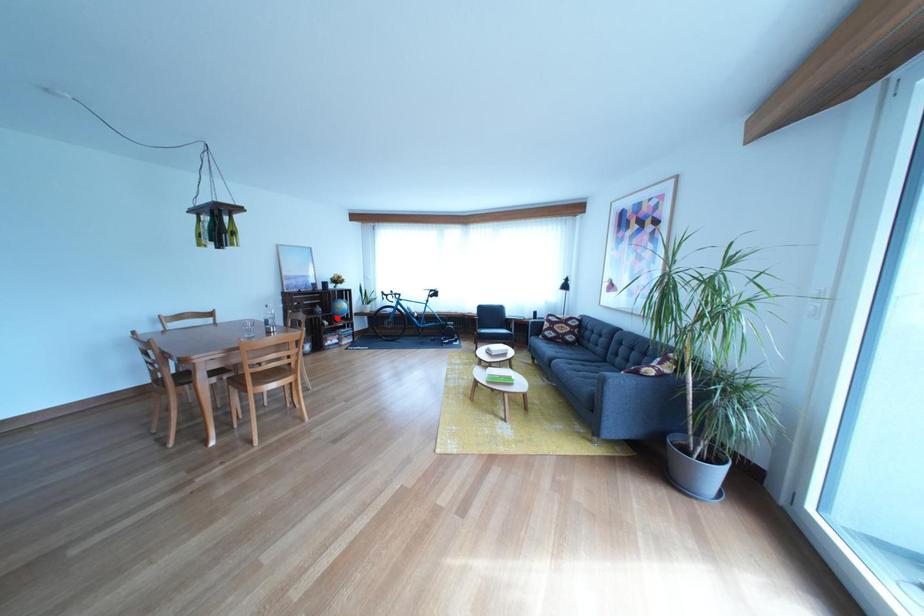
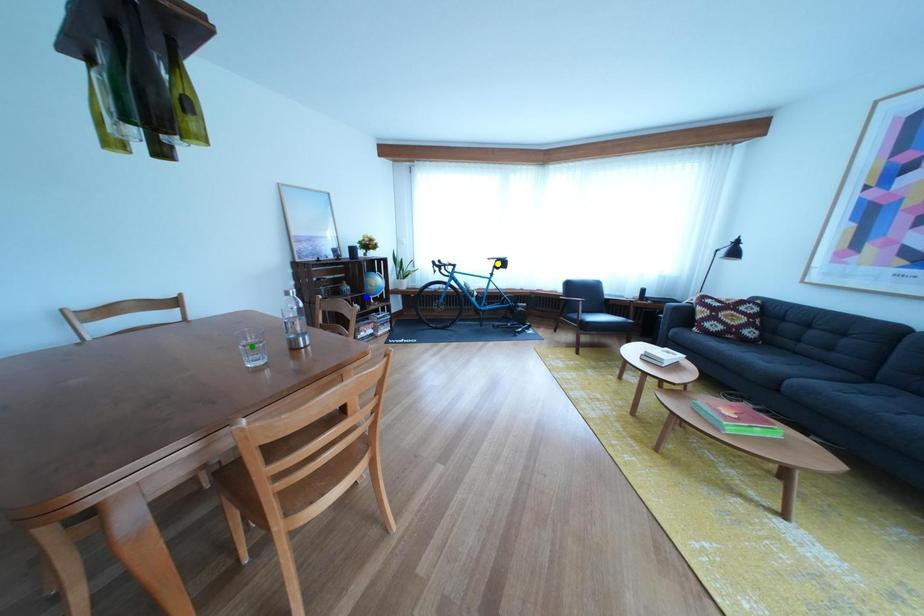
Question: I am providing you with two images of the same scene from different viewpoints. A red point is marked on the first image. You are given multiple points on the second image. Which mark in image 2 goes with the point in image 1?

Choices:
 (A) green point
 (B) yellow point
 (C) blue point

Answer: (C)